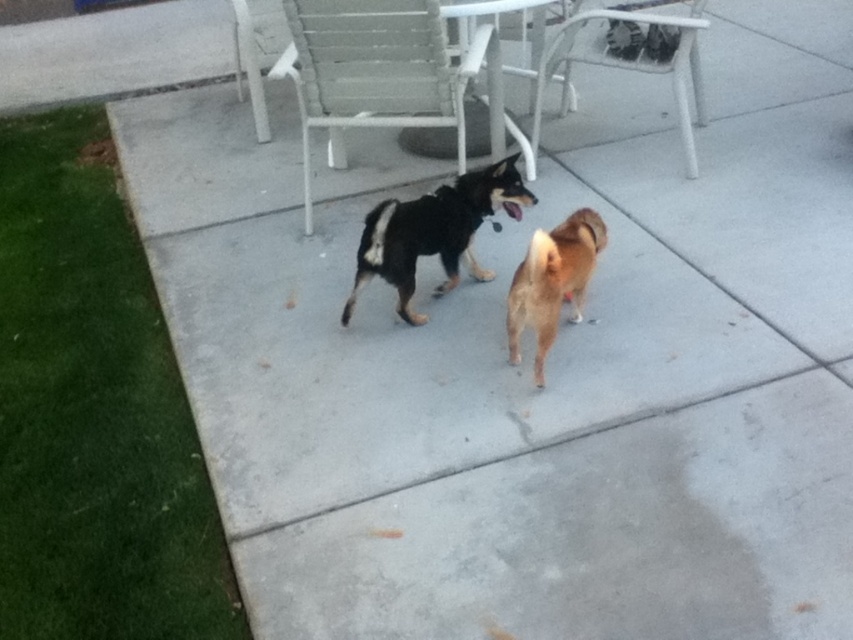
You are standing at the point with coordinates (386,76). What object is located exactly at your current position?

The white plastic chair at center is located exactly at the point with coordinates (386,76).

You are planning to place a small potted plant between the white plastic chair at center and the white plastic chair at upper center. Based on their positions, which chair should the plant be closer to?

Answer: The white plastic chair at center is located below the white plastic chair at upper center. Therefore, the plant should be placed closer to the white plastic chair at center to maintain a balanced arrangement.

You are standing at the point labeled as point (531,202) on the patio. You want to throw a ball to your friend who is standing 2.61 meters away from you. Can you estimate how far you need to throw the ball to reach your friend?

The distance between you and your friend is 2.61 meters, so you need to throw the ball approximately 2.61 meters to reach them.